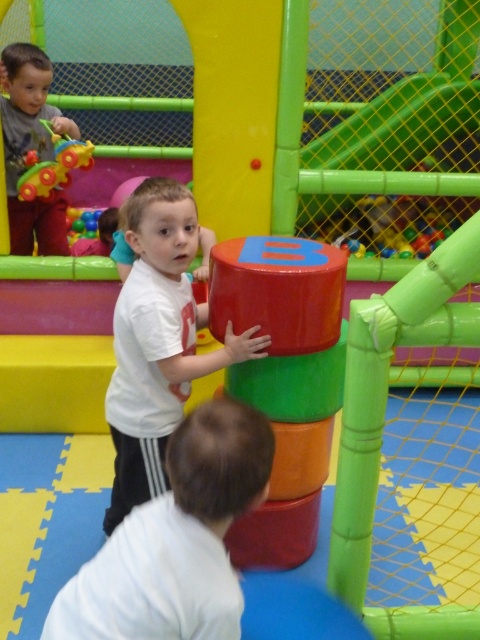
Question: Which point is closer to the camera?

Choices:
 (A) matte black toy car at left
 (B) white matte shirt at lower center

Answer: (B)

Question: Is matte black toy car at left above rubberized plastic toy at upper left?

Choices:
 (A) yes
 (B) no

Answer: (A)

Question: Is white matte shirt at lower center thinner than matte white shirt at center?

Choices:
 (A) no
 (B) yes

Answer: (B)

Question: Which is nearer to the rubberized plastic toy at upper left?

Choices:
 (A) matte white shirt at center
 (B) white matte shirt at lower center
 (C) matte black toy car at left

Answer: (C)

Question: Which point is farther to the camera?

Choices:
 (A) (66, 136)
 (B) (147, 316)
 (C) (0, 120)
 (D) (116, 634)

Answer: (A)

Question: Considering the relative positions of white matte shirt at lower center and rubberized plastic toy at upper left in the image provided, where is white matte shirt at lower center located with respect to rubberized plastic toy at upper left?

Choices:
 (A) right
 (B) left

Answer: (A)